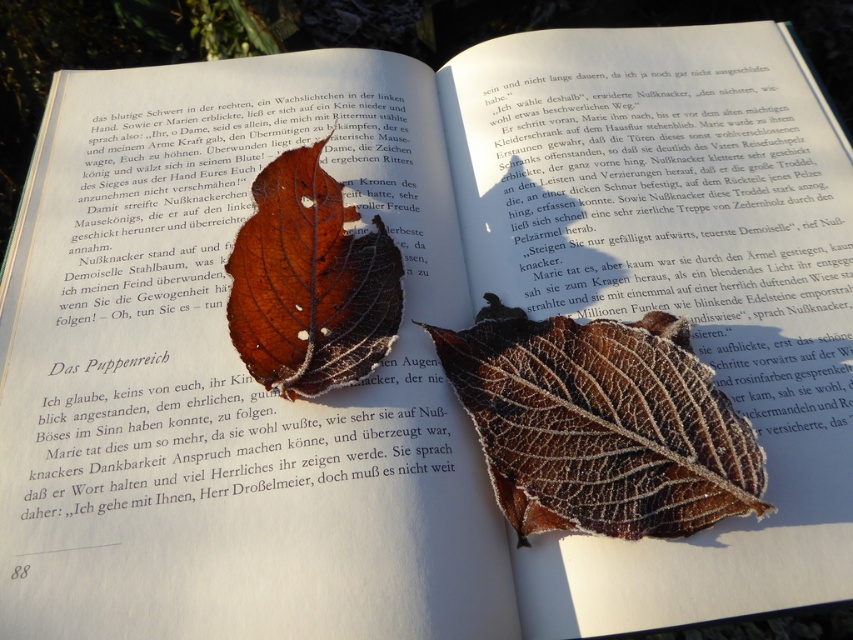
Question: Which point is farther to the camera?

Choices:
 (A) frosted brown leaf at center
 (B) frosty brown leaf at center

Answer: (B)

Question: Can you confirm if frosted brown leaf at center is bigger than frosty brown leaf at center?

Choices:
 (A) yes
 (B) no

Answer: (A)

Question: Does frosted brown leaf at center appear on the left side of frosty brown leaf at center?

Choices:
 (A) no
 (B) yes

Answer: (A)

Question: Which object is farther from the camera taking this photo?

Choices:
 (A) frosted brown leaf at center
 (B) frosty brown leaf at center

Answer: (B)

Question: Is frosted brown leaf at center to the right of frosty brown leaf at center from the viewer's perspective?

Choices:
 (A) yes
 (B) no

Answer: (A)